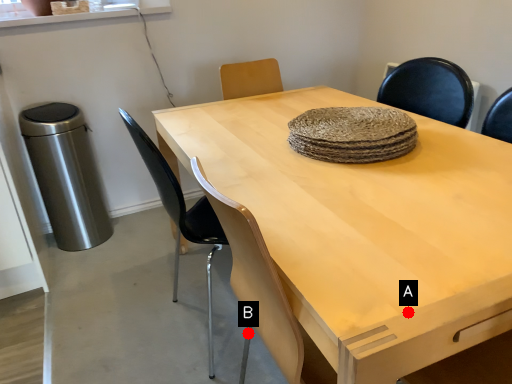
Question: Two points are circled on the image, labeled by A and B beside each circle. Which point is closer to the camera?

Choices:
 (A) A is closer
 (B) B is closer

Answer: (A)